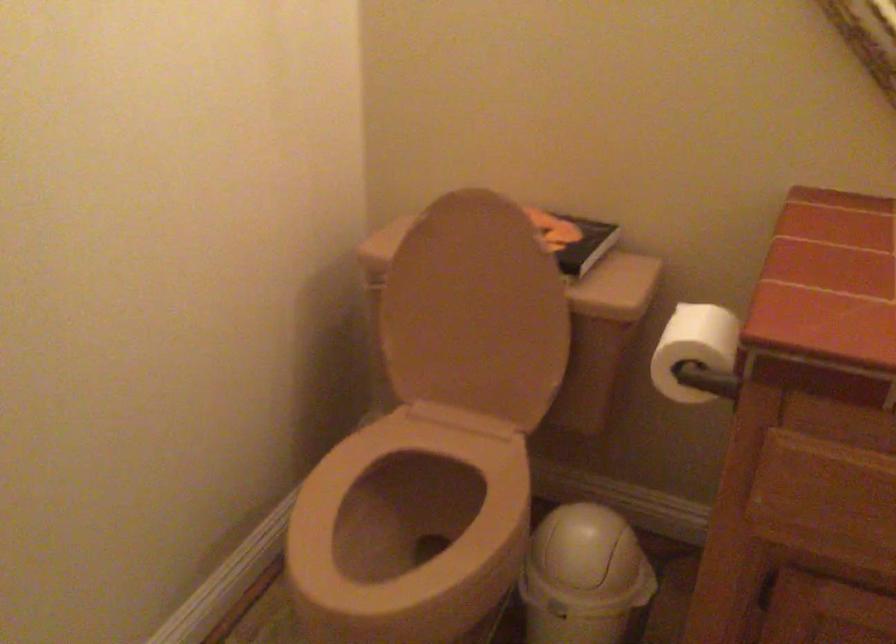
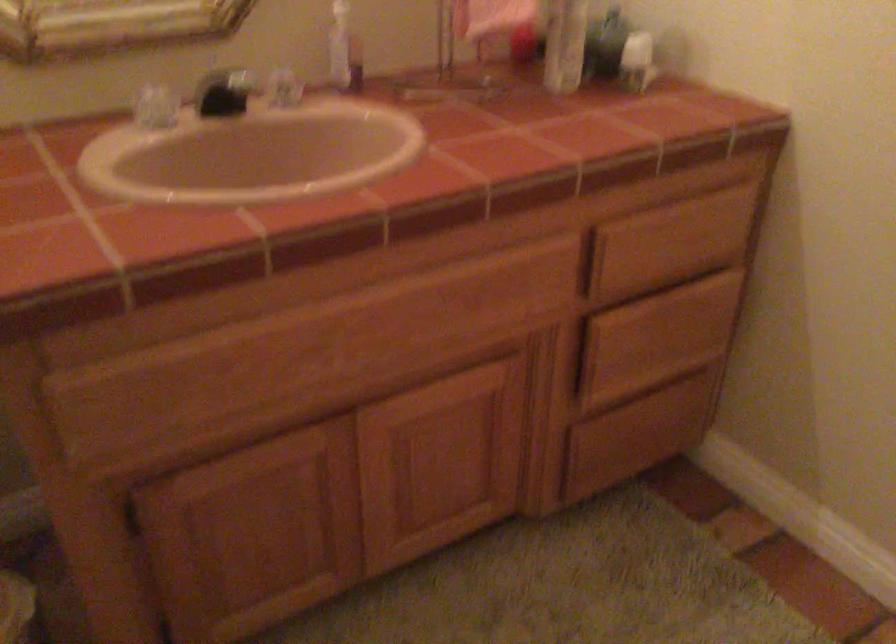
Based on the continuous images, in which direction is the camera rotating?

The rotation direction of the camera is right-down.